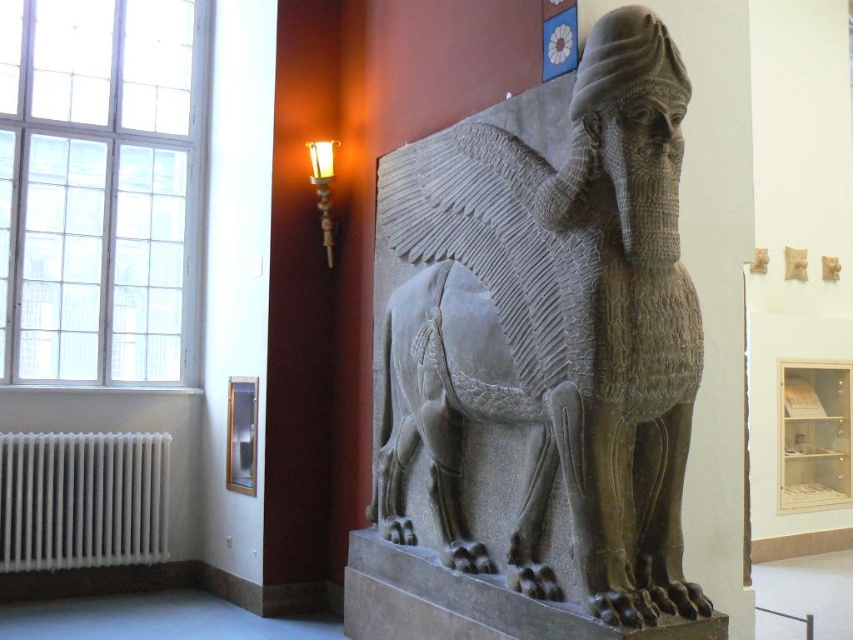
Question: Is gray stone winged lion at center to the right of white metallic radiator at lower left from the viewer's perspective?

Choices:
 (A) no
 (B) yes

Answer: (B)

Question: Which of the following is the farthest from the observer?

Choices:
 (A) (422, 440)
 (B) (0, 541)

Answer: (B)

Question: Which of the following is the closest to the observer?

Choices:
 (A) (144, 538)
 (B) (480, 381)

Answer: (B)

Question: From the image, what is the correct spatial relationship of gray stone winged lion at center in relation to white metallic radiator at lower left?

Choices:
 (A) below
 (B) above

Answer: (B)

Question: Can you confirm if gray stone winged lion at center is smaller than white metallic radiator at lower left?

Choices:
 (A) no
 (B) yes

Answer: (A)